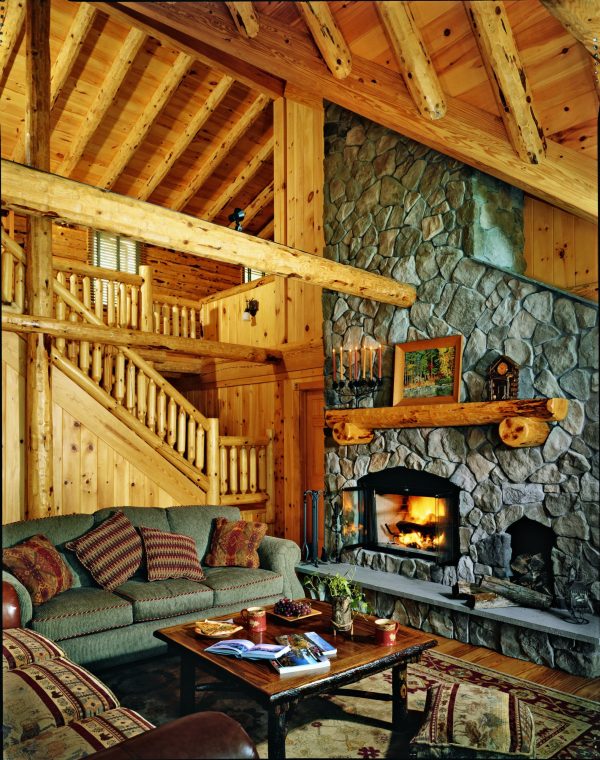
Find the location of `back pillows of gray sofa`. back pillows of gray sofa is located at coordinates (192, 518), (66, 524), (145, 520).